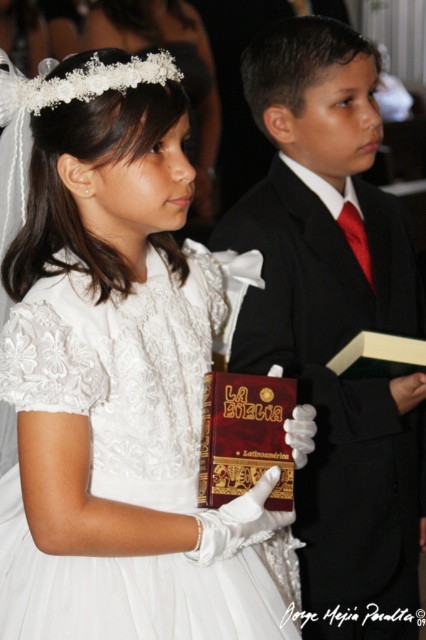
Question: Is white lace dress at center smaller than shiny black suit at center?

Choices:
 (A) no
 (B) yes

Answer: (B)

Question: Which object is positioned farthest from the dark red leather bible at center?

Choices:
 (A) white lace dress at center
 (B) shiny black suit at center

Answer: (B)

Question: Which of the following is the closest to the observer?

Choices:
 (A) (325, 324)
 (B) (91, 550)

Answer: (B)

Question: Can you confirm if white lace dress at center is thinner than dark red leather bible at center?

Choices:
 (A) no
 (B) yes

Answer: (A)

Question: Which point appears closest to the camera in this image?

Choices:
 (A) (77, 177)
 (B) (255, 456)
 (C) (347, 504)

Answer: (A)

Question: Does white lace dress at center appear on the left side of shiny black suit at center?

Choices:
 (A) no
 (B) yes

Answer: (B)